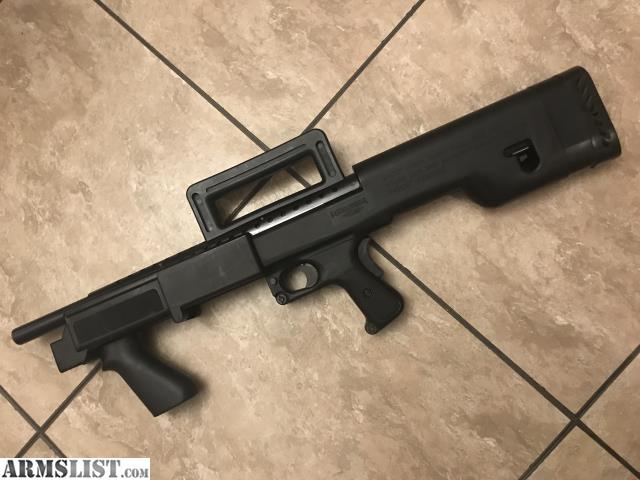
At what (x,y) coordinates should I click in order to perform the action: click on floor tiles. Please return your answer as a coordinate pair (x, y). The height and width of the screenshot is (480, 640). Looking at the image, I should click on (267, 397).